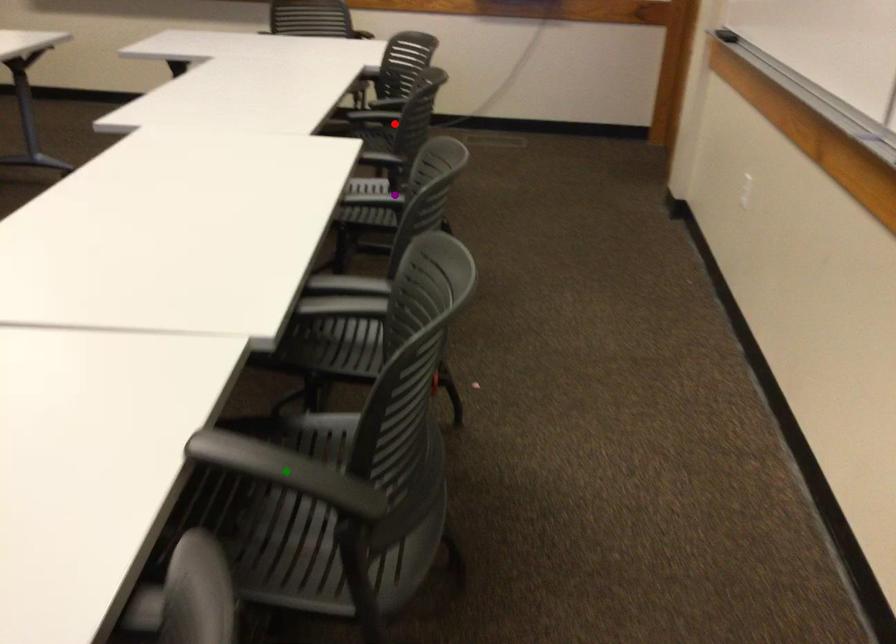
Order these from nearest to farthest:
- red point
- purple point
- green point

1. green point
2. purple point
3. red point